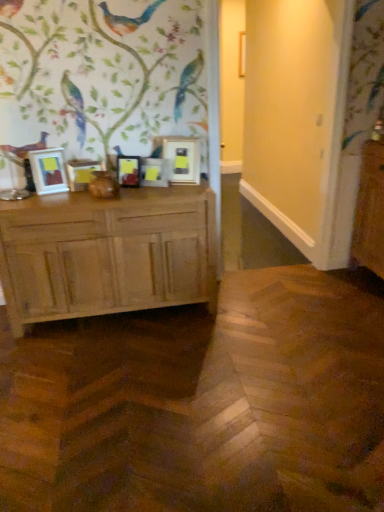
Question: Is point (167, 165) closer or farther from the camera than point (6, 209)?

Choices:
 (A) closer
 (B) farther

Answer: (B)

Question: Is matte wooden picture frame at center, which is counted as the 2th picture frame, starting from the right, inside the boundaries of light brown wood chest of drawers at left, or outside?

Choices:
 (A) outside
 (B) inside

Answer: (A)

Question: Estimate the real-world distances between objects in this image. Which object is closer to the matte wooden picture frame at center, which is counted as the 2th picture frame, starting from the right?

Choices:
 (A) matte wooden picture frame at left, marked as the 1th picture frame in a left-to-right arrangement
 (B) matte black picture frame at center, which is the 3th picture frame from right to left
 (C) light brown wood chest of drawers at left
 (D) matte wooden picture frame at left, the fourth picture frame from the right
 (E) matte gold picture frame at center, which is the first picture frame from right to left

Answer: (B)

Question: Which object is positioned closest to the matte wooden picture frame at center, which is the 4th picture frame from left to right?

Choices:
 (A) matte gold picture frame at center, which is the first picture frame from right to left
 (B) light brown wood chest of drawers at left
 (C) matte black picture frame at center, which ranks as the third picture frame in left-to-right order
 (D) matte wooden picture frame at left, placed as the second picture frame when sorted from left to right
 (E) matte wooden picture frame at left, marked as the 1th picture frame in a left-to-right arrangement

Answer: (C)